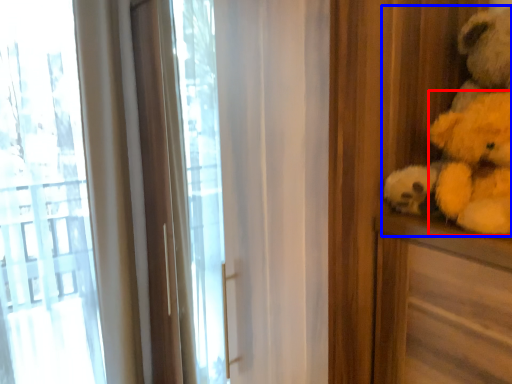
Question: Among these objects, which one is farthest to the camera, animal (highlighted by a red box) or teddy bear (highlighted by a blue box)?

Choices:
 (A) animal
 (B) teddy bear

Answer: (B)